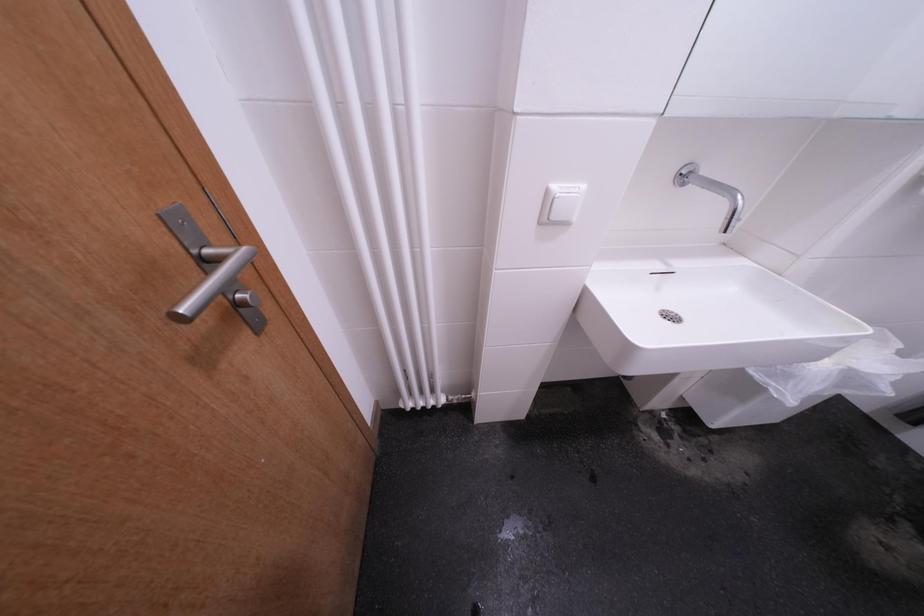
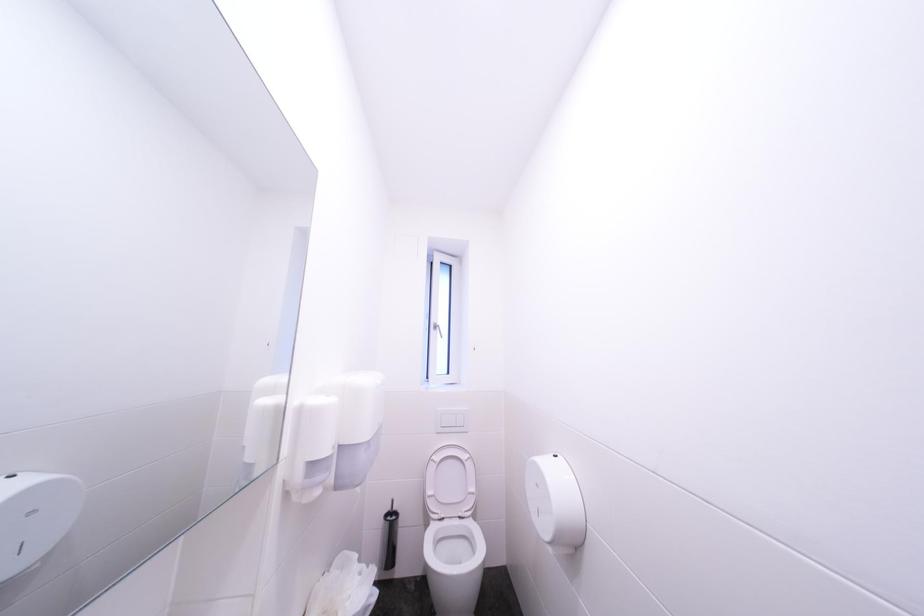
Question: The images are taken continuously from a first-person perspective. In which direction is your viewpoint rotating?

Choices:
 (A) Left
 (B) Right
 (C) Up
 (D) Down

Answer: (B)